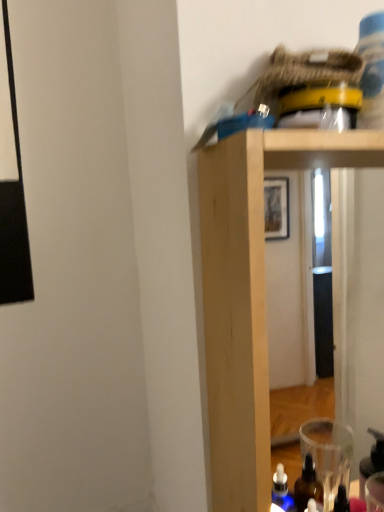
This screenshot has height=512, width=384. What are the coordinates of `natural wood shelf at center` in the screenshot? It's located at (248, 295).

The image size is (384, 512). What do you see at coordinates (248, 295) in the screenshot?
I see `natural wood shelf at center` at bounding box center [248, 295].

Identify the location of natural wood shelf at center. (248, 295).